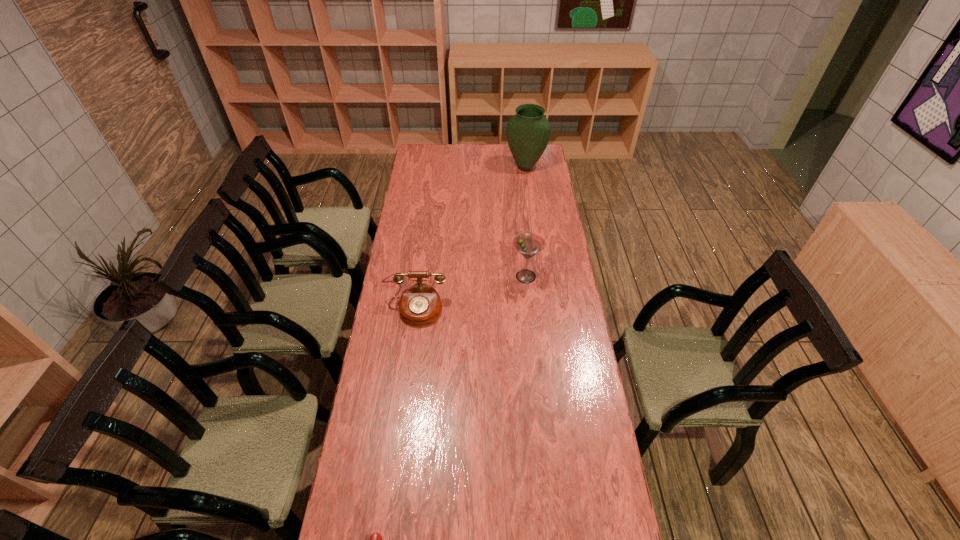
This screenshot has height=540, width=960. I want to click on vase, so click(528, 132).

Find the location of `the tallest object`. the tallest object is located at coordinates (528, 132).

Find the location of `the third shortest object`. the third shortest object is located at coordinates (528, 244).

At what (x,y) coordinates should I click in order to perform the action: click on martini. Please return your answer as a coordinate pair (x, y). Looking at the image, I should click on (528, 244).

This screenshot has height=540, width=960. What are the coordinates of `the second nearest object` in the screenshot? It's located at (420, 304).

Where is `the taller telephone`? the taller telephone is located at coordinates (420, 304).

Find the location of `vacant position located 0.110m on the front of the vase`. vacant position located 0.110m on the front of the vase is located at coordinates (528, 186).

This screenshot has height=540, width=960. I want to click on free location located on the back of the second farthest object, so click(x=519, y=215).

Where is `vacant area located on the dial of the taller telephone`? This screenshot has height=540, width=960. vacant area located on the dial of the taller telephone is located at coordinates (402, 402).

Where is `object located at the far edge`? The image size is (960, 540). object located at the far edge is located at coordinates (528, 132).